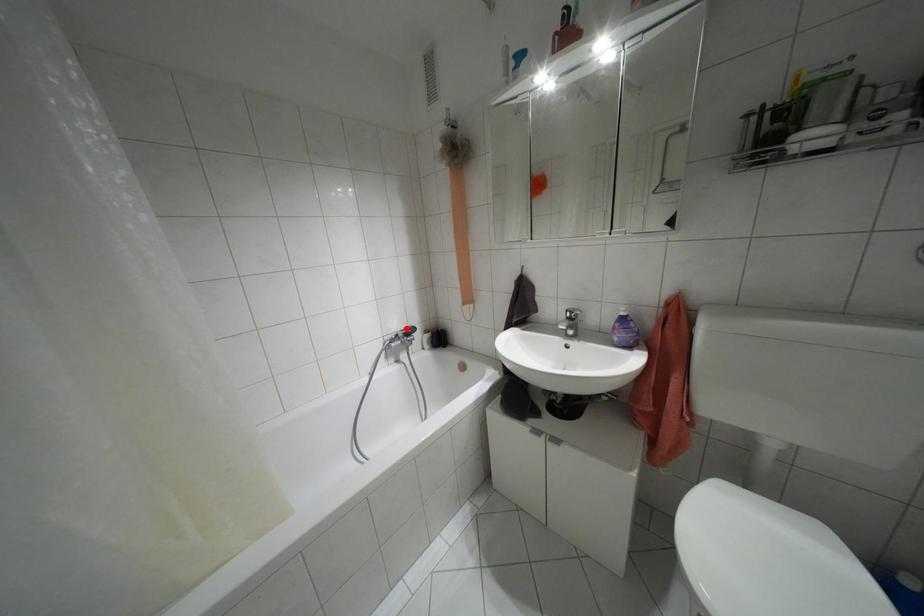
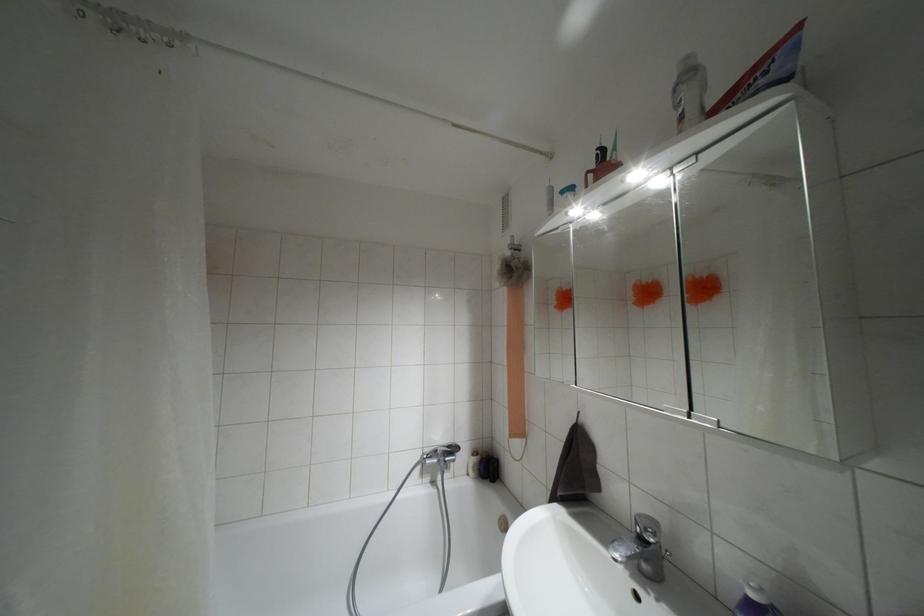
Where in the second image is the point corresponding to the highlighted location from the first image?

(447, 446)